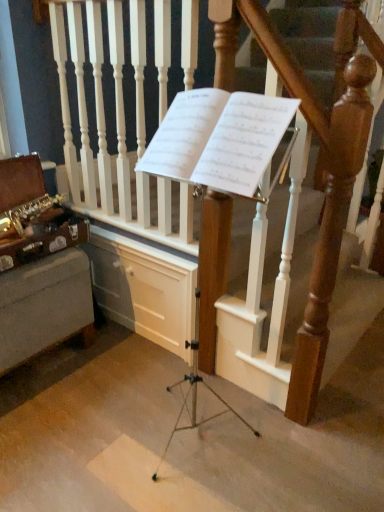
Describe the element at coordinates (221, 140) in the screenshot. I see `white paper at center` at that location.

Find the location of a particular element. gold brass saxophone at left is located at coordinates (43, 294).

The width and height of the screenshot is (384, 512). I want to click on white paper at center, so click(x=221, y=140).

Is the position of white paper at center less distant than that of gold brass saxophone at left?

Yes, white paper at center is in front of gold brass saxophone at left.

Consider the image. Can you confirm if white paper at center is taller than gold brass saxophone at left?

No.

From the picture: Considering the relative sizes of white paper at center and gold brass saxophone at left in the image provided, is white paper at center bigger than gold brass saxophone at left?

No, white paper at center is not bigger than gold brass saxophone at left.

Considering the points (265, 197) and (48, 325), which point is behind, point (265, 197) or point (48, 325)?

The point (48, 325) is farther from the camera.

Which is in front, point (81, 289) or point (290, 398)?

The point (290, 398) is closer to the camera.

Is gold brass saxophone at left further to the viewer compared to wooden at center?

Yes, gold brass saxophone at left is further from the viewer.

Considering the relative sizes of gold brass saxophone at left and wooden at center in the image provided, is gold brass saxophone at left wider than wooden at center?

Correct, the width of gold brass saxophone at left exceeds that of wooden at center.

Who is more distant, white paper at center or wooden at center?

wooden at center is more distant.

From the image's perspective, is white paper at center above or below wooden at center?

white paper at center is situated higher than wooden at center in the image.

Do you think white paper at center is within wooden at center, or outside of it?

white paper at center is spatially situated outside wooden at center.

What's the angular difference between white paper at center and wooden at center's facing directions?

175 degrees.

Would you say wooden at center is inside or outside white paper at center?

wooden at center is not enclosed by white paper at center.

Based on their positions, is wooden at center located to the left or right of white paper at center?

wooden at center is to the left of white paper at center.

Which object is further away from the camera, wooden at center or white paper at center?

wooden at center is more distant.

From a real-world perspective, who is located higher, gold brass saxophone at left or white paper at center?

white paper at center, from a real-world perspective.

What's the angular difference between gold brass saxophone at left and white paper at center's facing directions?

They differ by 95.2 degrees in their facing directions.

Is gold brass saxophone at left touching white paper at center?

No, gold brass saxophone at left is not making contact with white paper at center.

Considering the sizes of objects gold brass saxophone at left and white paper at center in the image provided, who is wider, gold brass saxophone at left or white paper at center?

gold brass saxophone at left.

In the scene shown: Does wooden at center have a lesser height compared to gold brass saxophone at left?

Incorrect, the height of wooden at center does not fall short of that of gold brass saxophone at left.

From a real-world perspective, between wooden at center and gold brass saxophone at left, who is vertically higher?

wooden at center, from a real-world perspective.

How far apart are wooden at center and gold brass saxophone at left?

The distance of wooden at center from gold brass saxophone at left is 22.95 inches.

Considering the positions of point (160, 221) and point (29, 285), is point (160, 221) closer or farther from the camera than point (29, 285)?

Point (160, 221) is positioned farther from the camera compared to point (29, 285).

In the image, there is a gold brass saxophone at left. Identify the location of sheet music above it (from the image's perspective). The width and height of the screenshot is (384, 512). (221, 140).

Find the location of a particular element. The height and width of the screenshot is (512, 384). furniture that appears below the wooden at center (from the image's perspective) is located at coordinates (43, 294).

Which object lies nearer to the anchor point gold brass saxophone at left, wooden at center or white paper at center?

Based on the image, wooden at center appears to be nearer to gold brass saxophone at left.

Looking at this image, which object lies further to the anchor point gold brass saxophone at left, white paper at center or wooden at center?

The object further to gold brass saxophone at left is white paper at center.

Estimate the real-world distances between objects in this image. Which object is further from wooden at center, white paper at center or gold brass saxophone at left?

The object further to wooden at center is gold brass saxophone at left.

From the image, which object appears to be farther from white paper at center, wooden at center or gold brass saxophone at left?

gold brass saxophone at left is positioned further to the anchor white paper at center.

From the image, which object appears to be farther from white paper at center, gold brass saxophone at left or wooden at center?

Based on the image, gold brass saxophone at left appears to be further to white paper at center.

Looking at the image, which one is located closer to wooden at center, gold brass saxophone at left or white paper at center?

white paper at center is positioned closer to the anchor wooden at center.

Find the location of a particular element. This screenshot has height=512, width=384. stairs between gold brass saxophone at left and white paper at center in the horizontal direction is located at coordinates (286, 222).